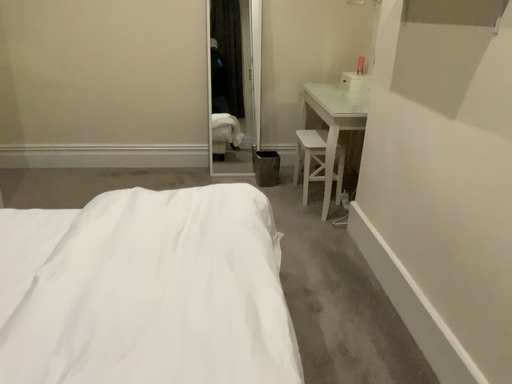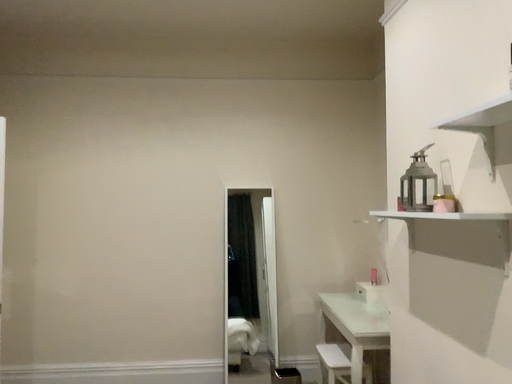
Question: How did the camera likely rotate when shooting the video?

Choices:
 (A) rotated upward
 (B) rotated downward

Answer: (A)